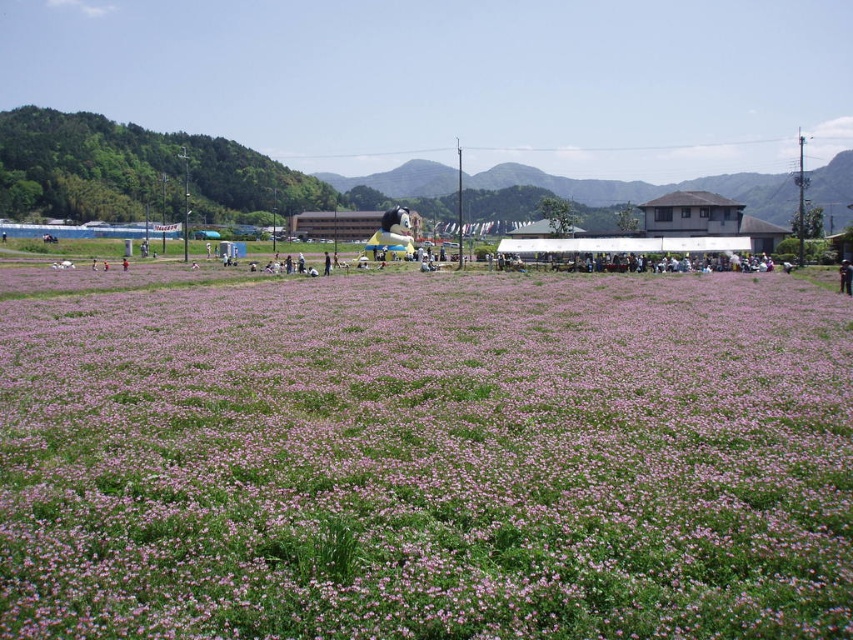
Question: Which point appears farthest from the camera in this image?

Choices:
 (A) (846, 266)
 (B) (515, 371)

Answer: (A)

Question: Is pink matte flowers at center wider than brown leather jacket at lower right?

Choices:
 (A) yes
 (B) no

Answer: (A)

Question: Is pink matte flowers at center positioned behind brown leather jacket at lower right?

Choices:
 (A) no
 (B) yes

Answer: (A)

Question: Is pink matte flowers at center further to the viewer compared to brown leather jacket at lower right?

Choices:
 (A) no
 (B) yes

Answer: (A)

Question: Which point appears farthest from the camera in this image?

Choices:
 (A) (850, 262)
 (B) (245, 540)

Answer: (A)